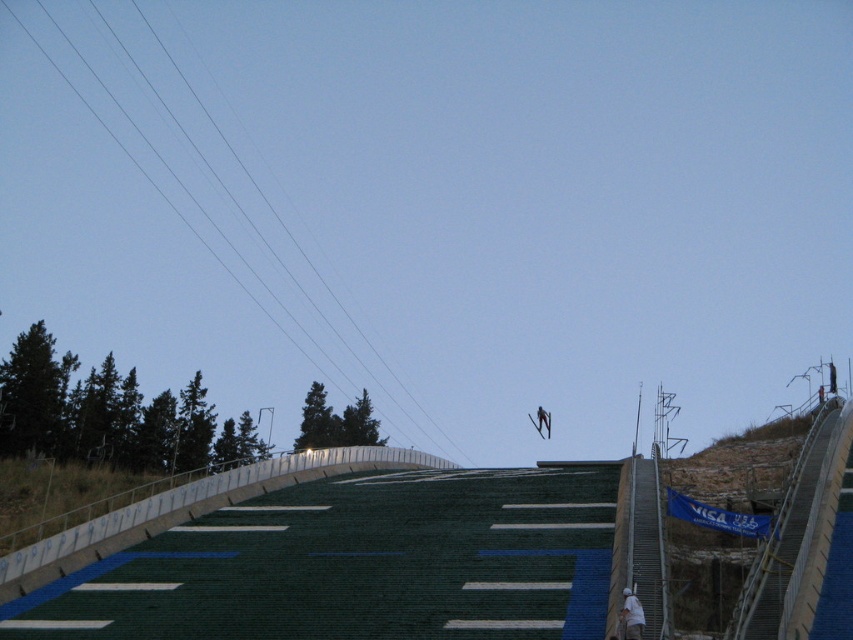
Question: Where is white fabric at lower right located in relation to metallic silver ski at center in the image?

Choices:
 (A) below
 (B) above

Answer: (B)

Question: Which object appears closest to the camera in this image?

Choices:
 (A) metallic silver ski at center
 (B) white fabric at lower right

Answer: (B)

Question: Considering the relative positions of white fabric at lower right and metallic silver ski at center in the image provided, where is white fabric at lower right located with respect to metallic silver ski at center?

Choices:
 (A) below
 (B) above

Answer: (B)

Question: Which point appears farthest from the camera in this image?

Choices:
 (A) (548, 424)
 (B) (636, 605)

Answer: (A)

Question: In this image, where is white fabric at lower right located relative to metallic silver ski at center?

Choices:
 (A) above
 (B) below

Answer: (A)

Question: Among these objects, which one is nearest to the camera?

Choices:
 (A) metallic silver ski at center
 (B) white fabric at lower right

Answer: (B)